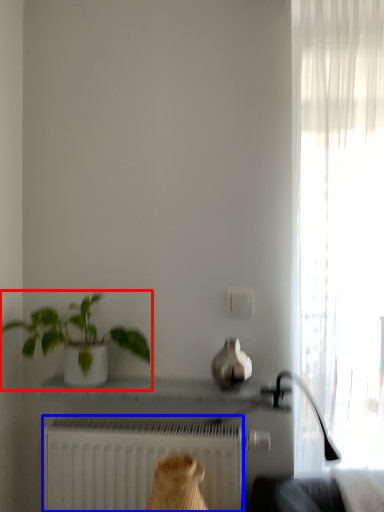
Question: Which point is closer to the camera, houseplant (highlighted by a red box) or radiator (highlighted by a blue box)?

Choices:
 (A) houseplant
 (B) radiator

Answer: (A)